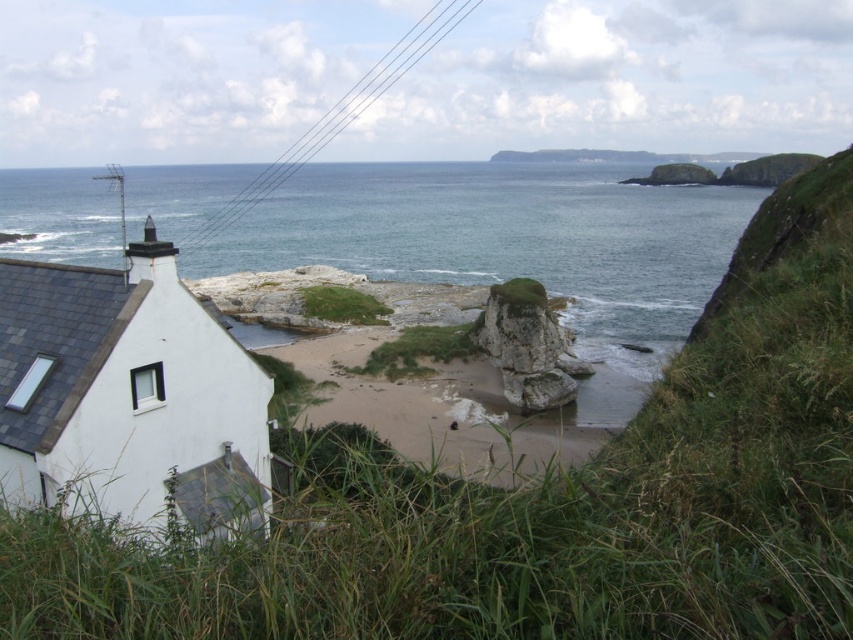
Question: Based on their relative distances, which object is farther from the blue water at center?

Choices:
 (A) rough stone rock at center
 (B) white matte house at lower left

Answer: (A)

Question: Which point is farther to the camera?

Choices:
 (A) rough stone rock at center
 (B) blue water at center
 (C) white matte house at lower left

Answer: (A)

Question: Can you confirm if blue water at center is positioned to the right of white matte house at lower left?

Choices:
 (A) no
 (B) yes

Answer: (A)

Question: Which of these objects is positioned closest to the blue water at center?

Choices:
 (A) white matte house at lower left
 (B) rough stone rock at center

Answer: (A)

Question: Is blue water at center positioned at the back of white matte house at lower left?

Choices:
 (A) no
 (B) yes

Answer: (B)

Question: Is blue water at center bigger than rough stone rock at center?

Choices:
 (A) no
 (B) yes

Answer: (B)